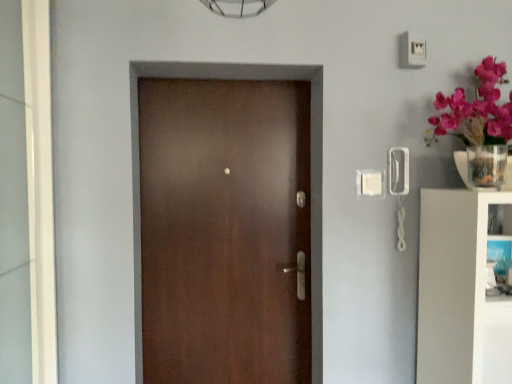
Question: Considering the relative sizes of white glossy bookshelf at right and satin brown door at center in the image provided, is white glossy bookshelf at right thinner than satin brown door at center?

Choices:
 (A) no
 (B) yes

Answer: (A)

Question: Does white glossy bookshelf at right lie in front of satin brown door at center?

Choices:
 (A) yes
 (B) no

Answer: (A)

Question: Is white glossy bookshelf at right with satin brown door at center?

Choices:
 (A) yes
 (B) no

Answer: (B)

Question: Does white glossy bookshelf at right turn towards satin brown door at center?

Choices:
 (A) yes
 (B) no

Answer: (B)

Question: Does white glossy bookshelf at right have a smaller size compared to satin brown door at center?

Choices:
 (A) yes
 (B) no

Answer: (B)

Question: Is satin brown door at center surrounded by white glossy bookshelf at right?

Choices:
 (A) yes
 (B) no

Answer: (B)

Question: Could you tell me if white glossy glass door at left is facing white glossy bookshelf at right?

Choices:
 (A) no
 (B) yes

Answer: (B)

Question: From the image's perspective, is white glossy glass door at left under white glossy bookshelf at right?

Choices:
 (A) no
 (B) yes

Answer: (A)

Question: Does white glossy glass door at left come behind white glossy bookshelf at right?

Choices:
 (A) no
 (B) yes

Answer: (A)

Question: From a real-world perspective, is white glossy glass door at left positioned under white glossy bookshelf at right based on gravity?

Choices:
 (A) no
 (B) yes

Answer: (A)

Question: Considering the relative sizes of white glossy glass door at left and white glossy bookshelf at right in the image provided, is white glossy glass door at left taller than white glossy bookshelf at right?

Choices:
 (A) yes
 (B) no

Answer: (A)

Question: Is white glossy glass door at left next to white glossy bookshelf at right?

Choices:
 (A) no
 (B) yes

Answer: (A)

Question: Is the depth of clear glass vase at upper right less than that of white glossy bookshelf at right?

Choices:
 (A) no
 (B) yes

Answer: (A)